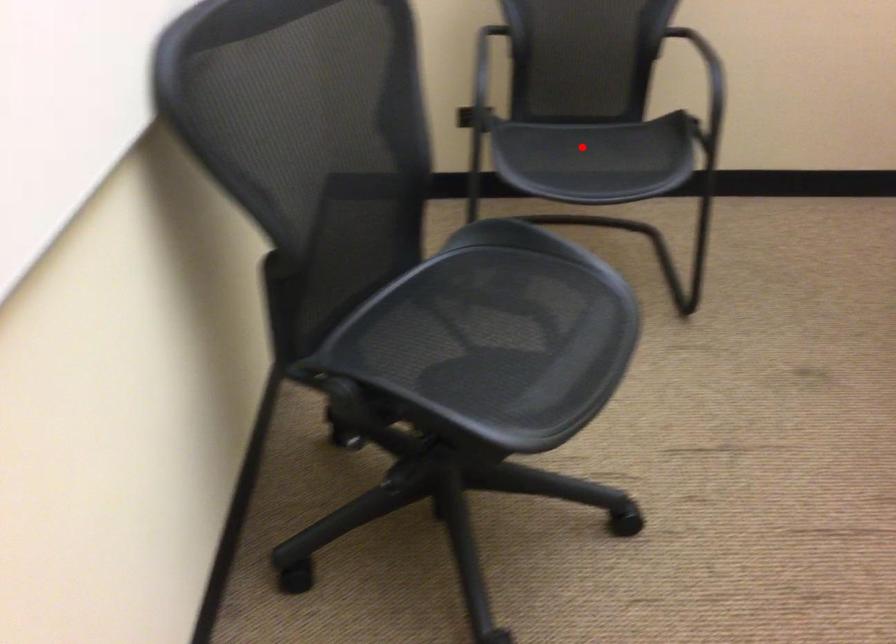
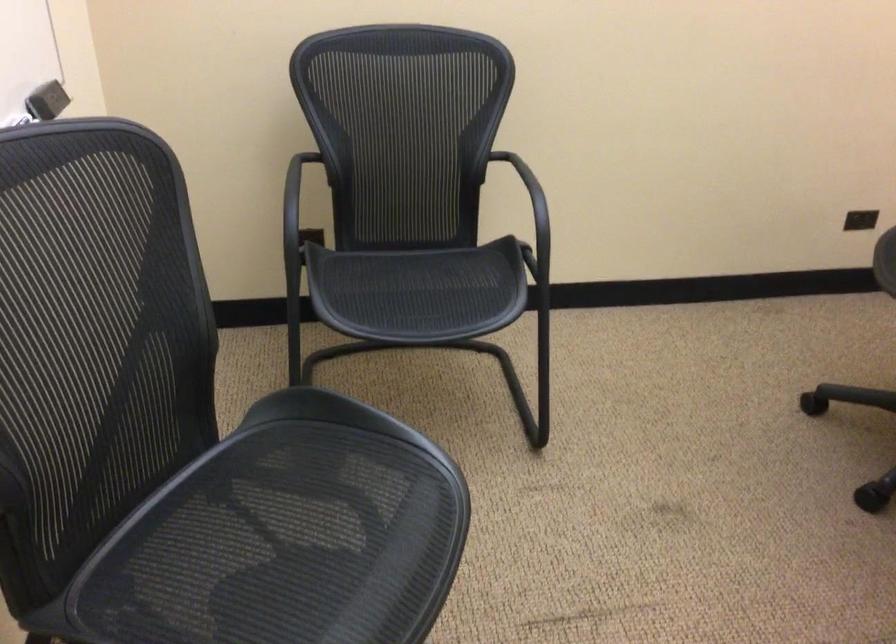
Find the pixel in the second image that matches the highlighted location in the first image.

(409, 287)